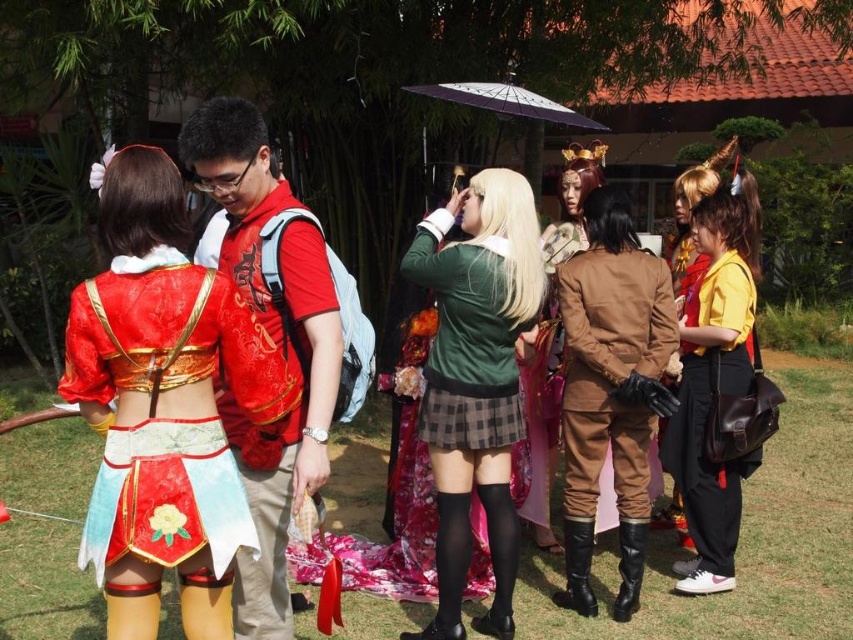
You are a photographer at the event and need to capture both the green velvet jacket at center and the shiny red shirt at center in the same frame. The camera has a minimum focus distance of 1 meter. Can you take the photo without moving either subject?

The green velvet jacket at center and the shiny red shirt at center are 1.01 meters apart. Since the distance is slightly over 1 meter, the camera can focus on both subjects as they are just beyond the minimum focus distance.